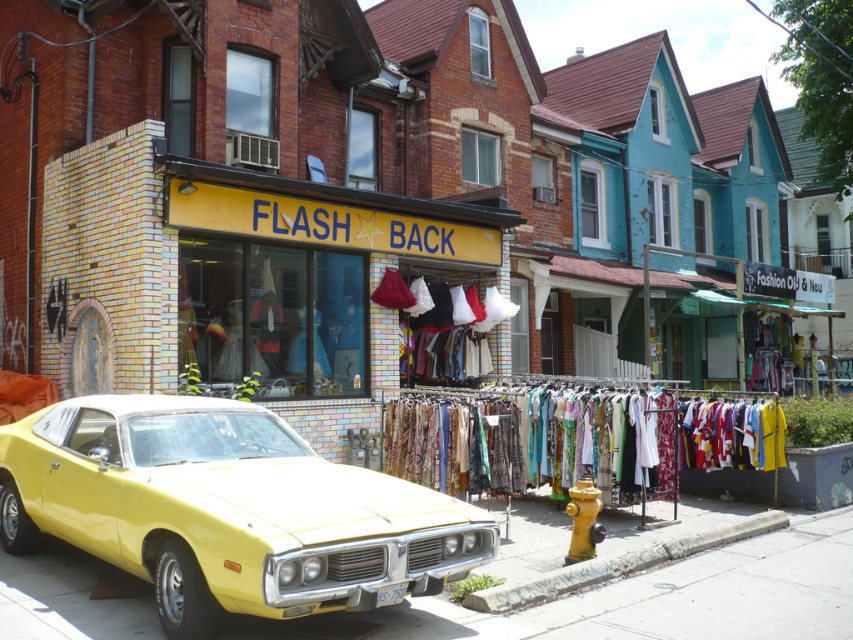
Which is in front, point (408, 604) or point (496, 611)?

Point (496, 611) is in front.

Does point (633, 602) lie behind point (541, 589)?

No, (633, 602) is in front of (541, 589).

Is point (537, 528) more distant than point (547, 588)?

Yes, point (537, 528) is behind point (547, 588).

Where is `yellow concrete pavement at lower left`? yellow concrete pavement at lower left is located at coordinates (647, 598).

Can you confirm if yellow concrete pavement at lower left is positioned below yellow matte fire hydrant at lower center?

Yes.

Can you confirm if yellow concrete pavement at lower left is positioned to the right of yellow matte fire hydrant at lower center?

Yes, yellow concrete pavement at lower left is to the right of yellow matte fire hydrant at lower center.

What do you see at coordinates (647, 598) in the screenshot? The image size is (853, 640). I see `yellow concrete pavement at lower left` at bounding box center [647, 598].

You are a GUI agent. You are given a task and a screenshot of the screen. Output one action in this format:
    pyautogui.click(x=<x>, y=<y>)
    Task: Click on the yellow concrete pavement at lower left
    Image resolution: width=853 pixels, height=640 pixels.
    Given the screenshot: What is the action you would take?
    pyautogui.click(x=647, y=598)

Is shiny yellow car at center positioned at the back of yellow matte fire hydrant at lower center?

No, shiny yellow car at center is in front of yellow matte fire hydrant at lower center.

Who is shorter, shiny yellow car at center or yellow matte fire hydrant at lower center?

Standing shorter between the two is yellow matte fire hydrant at lower center.

Measure the distance between point (x=207, y=541) and camera.

17.25 feet

Identify the location of shiny yellow car at center. (227, 509).